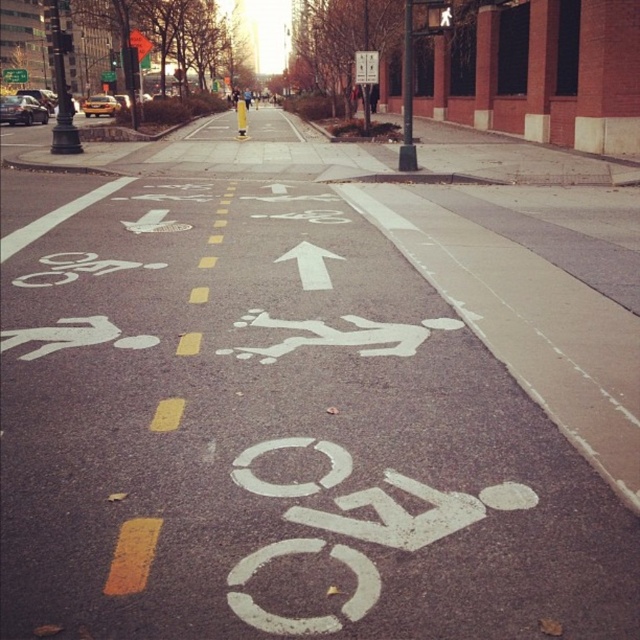
Between point (90, 307) and point (362, 76), which one is positioned behind?

The point (362, 76) is behind.

Identify the location of white painted bike lane at center. The image size is (640, 640). point(273,435).

Who is more forward, (470,467) or (13,80)?

Point (470,467) is more forward.

Where is `white painted bike lane at center`? The image size is (640, 640). white painted bike lane at center is located at coordinates (273, 435).

Which is in front, point (358, 74) or point (19, 80)?

Point (358, 74) is in front.

Between metallic rectangular sign at upper center and yellow plastic traffic sign at upper center, which one appears on the left side from the viewer's perspective?

yellow plastic traffic sign at upper center is more to the left.

You are a GUI agent. You are given a task and a screenshot of the screen. Output one action in this format:
    pyautogui.click(x=<x>, y=<y>)
    Task: Click on the metallic rectangular sign at upper center
    
    Given the screenshot: What is the action you would take?
    pyautogui.click(x=365, y=67)